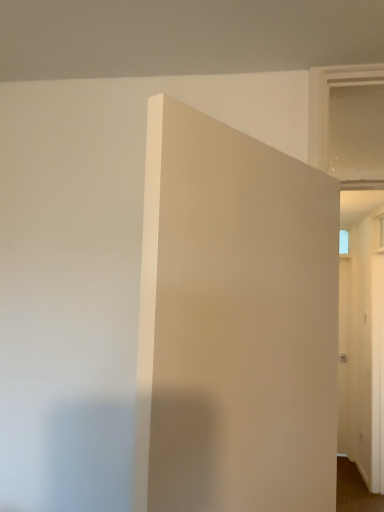
This screenshot has width=384, height=512. What do you see at coordinates (234, 322) in the screenshot?
I see `white matte screen door at center` at bounding box center [234, 322].

What is the approximate width of white matte screen door at center?

It is 5.17 inches.

At what (x,y) coordinates should I click in order to perform the action: click on white matte screen door at center. Please return your answer as a coordinate pair (x, y). This screenshot has height=512, width=384. Looking at the image, I should click on (234, 322).

Based on the photo, in order to face white matte screen door at center, should I rotate leftwards or rightwards?

Turn right by 9.965 degrees to look at white matte screen door at center.

Locate an element on the screen. This screenshot has width=384, height=512. white matte screen door at center is located at coordinates (234, 322).